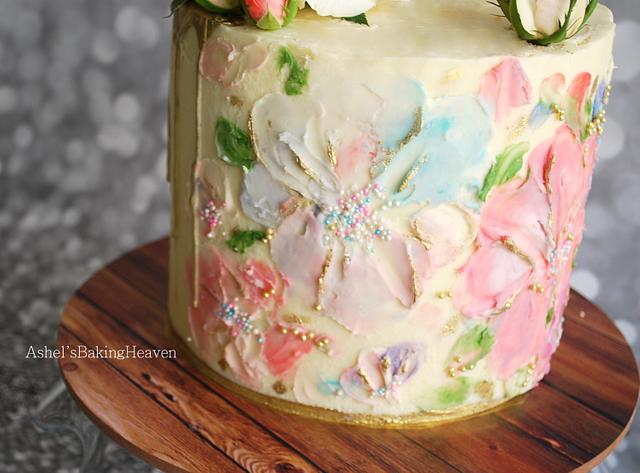
Find the location of a particular element. countertop in background right of cake is located at coordinates (614, 246).